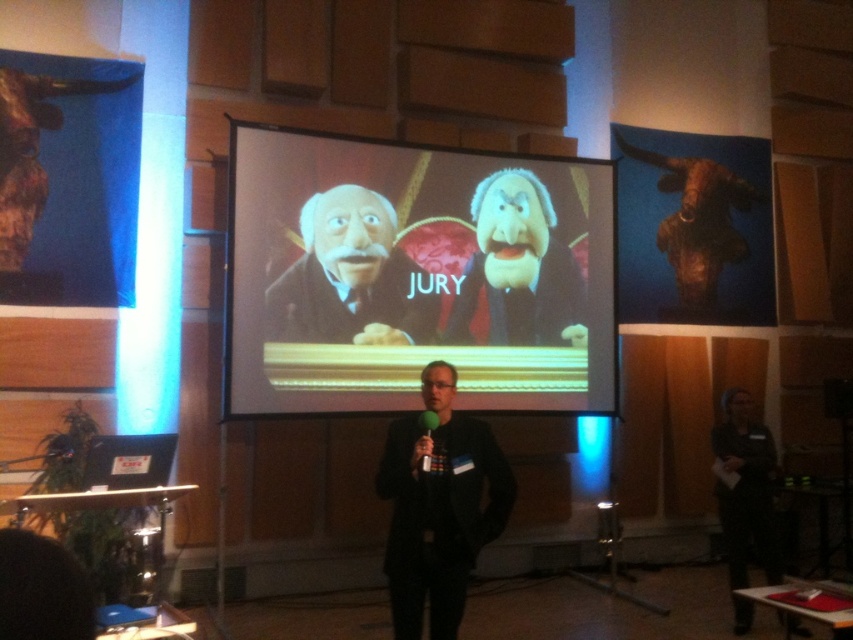
You are an attendee sitting in the front row of the conference room. You need to take a photo of the smooth puppet at center for your notes. Where should you aim your camera to capture it best?

The smooth puppet at center is located at the 2D coordinates point (x=518, y=268), so aim your camera at that position to capture it best.